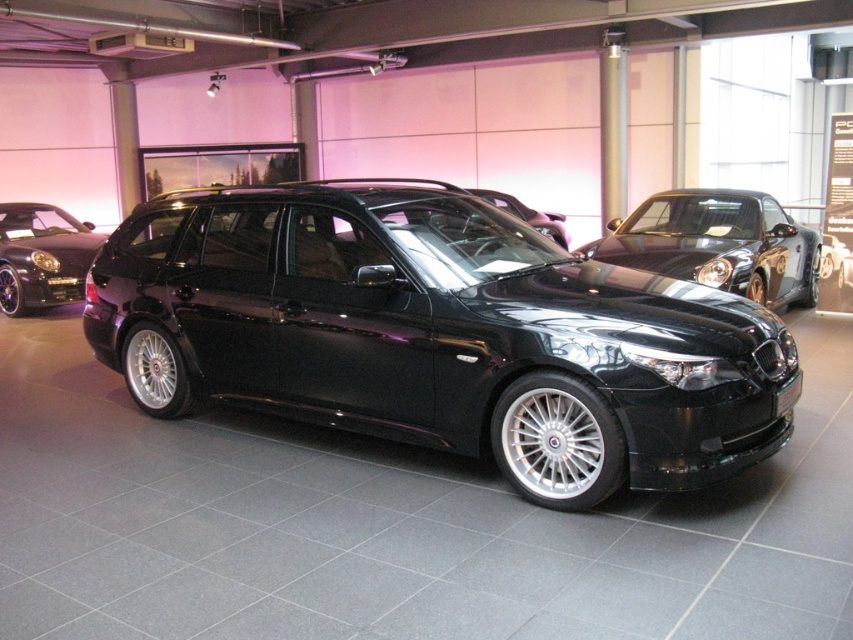
Between glossy black wagon at center and glossy black car at left, which one appears on the left side from the viewer's perspective?

glossy black car at left is more to the left.

Is glossy black wagon at center above glossy black car at left?

No, glossy black wagon at center is not above glossy black car at left.

Based on the photo, who is more distant from viewer, (538,396) or (96,232)?

The point (96,232) is behind.

You are a GUI agent. You are given a task and a screenshot of the screen. Output one action in this format:
    pyautogui.click(x=<x>, y=<y>)
    Task: Click on the glossy black wagon at center
    
    Given the screenshot: What is the action you would take?
    pyautogui.click(x=439, y=333)

Is glossy black wagon at center to the right of glossy black car at center from the viewer's perspective?

No, glossy black wagon at center is not to the right of glossy black car at center.

Where is `glossy black wagon at center`? glossy black wagon at center is located at coordinates (439, 333).

At what (x,y) coordinates should I click in order to perform the action: click on glossy black wagon at center. Please return your answer as a coordinate pair (x, y). The height and width of the screenshot is (640, 853). Looking at the image, I should click on 439,333.

Is glossy black car at center shorter than glossy black car at left?

Yes.

Measure the distance from glossy black car at center to glossy black car at left.

glossy black car at center and glossy black car at left are 24.52 feet apart from each other.

The image size is (853, 640). Identify the location of glossy black car at center. (718, 243).